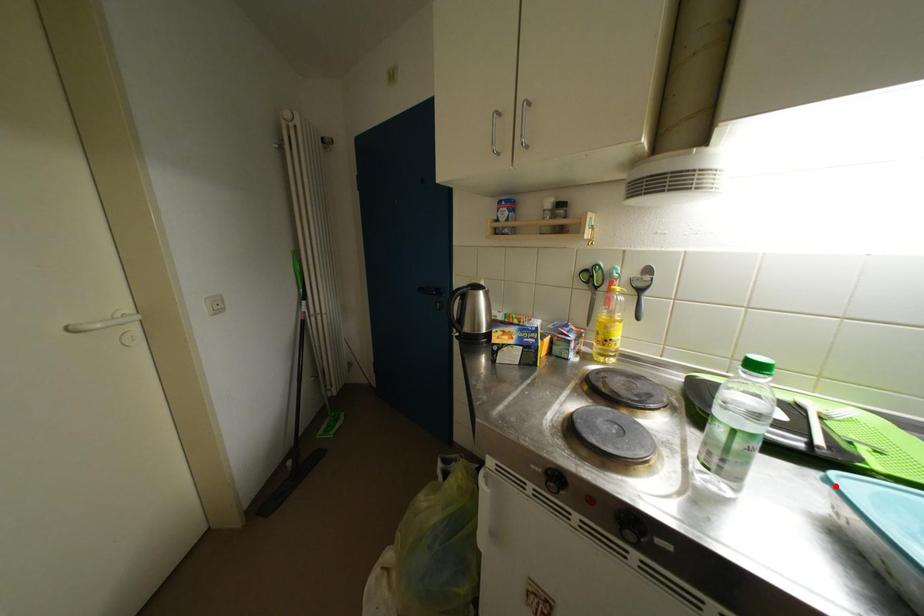
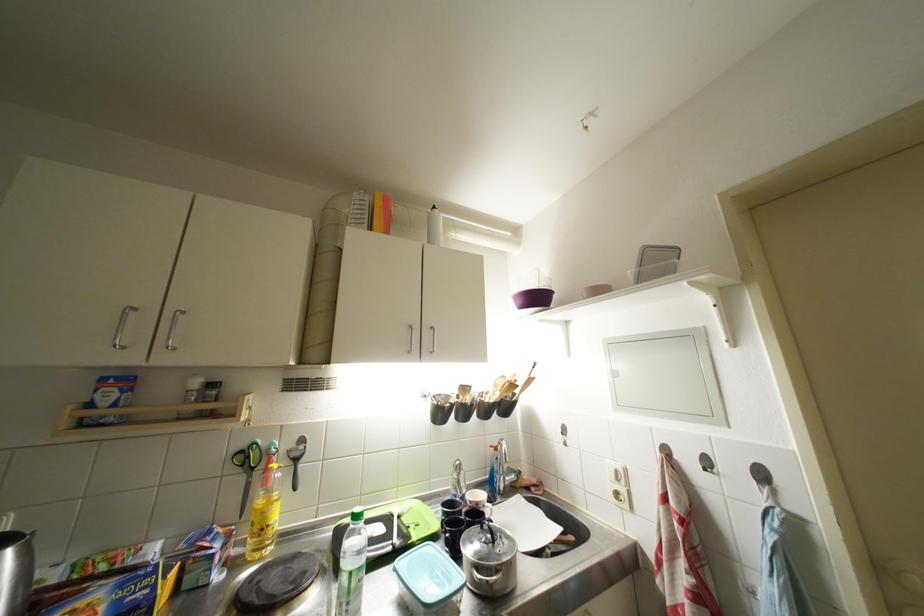
Find the pixel in the second image that matches the highlighted location in the first image.

(402, 573)